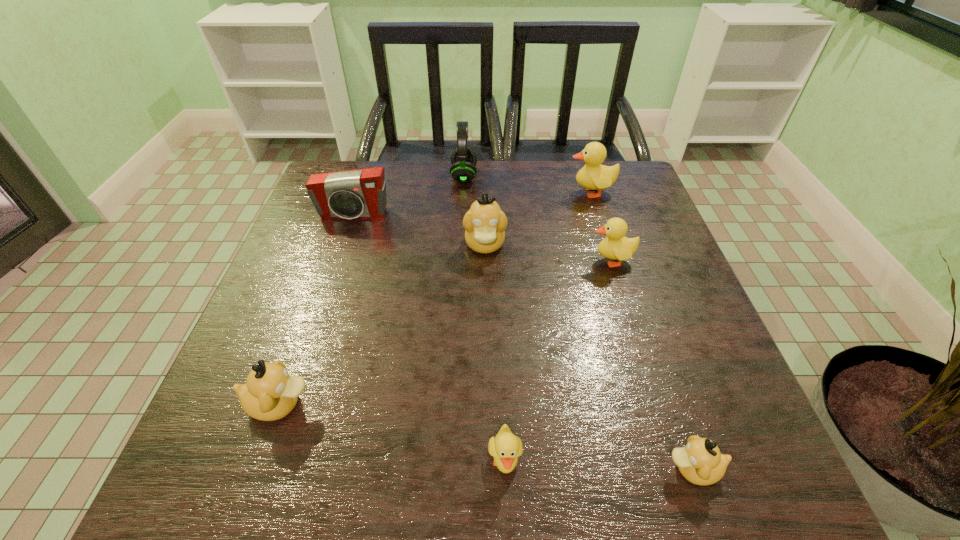
Image resolution: width=960 pixels, height=540 pixels. Find the location of `black headset`. black headset is located at coordinates (463, 159).

At what (x,y) coordinates should I click in order to perform the action: click on the biggest yellow duckling. Please return your answer as a coordinate pair (x, y). Looking at the image, I should click on (593, 176).

Locate an element on the screen. Image resolution: width=960 pixels, height=540 pixels. the farthest duckling is located at coordinates (593, 176).

At what (x,y) coordinates should I click in order to perform the action: click on the biggest tan duckling. Please return your answer as a coordinate pair (x, y). The image size is (960, 540). Looking at the image, I should click on (484, 224).

This screenshot has height=540, width=960. I want to click on the second tan duckling from left to right, so click(484, 224).

Where is `camera`? The image size is (960, 540). camera is located at coordinates (361, 193).

Identify the location of the second smallest yellow duckling. (616, 246).

Find the location of a particular element. Image resolution: width=960 pixels, height=540 pixels. the second biggest tan duckling is located at coordinates (270, 393).

Identify the location of the third nearest duckling. This screenshot has width=960, height=540. (270, 393).

Locate an element on the screen. The height and width of the screenshot is (540, 960). the smallest yellow duckling is located at coordinates (506, 447).